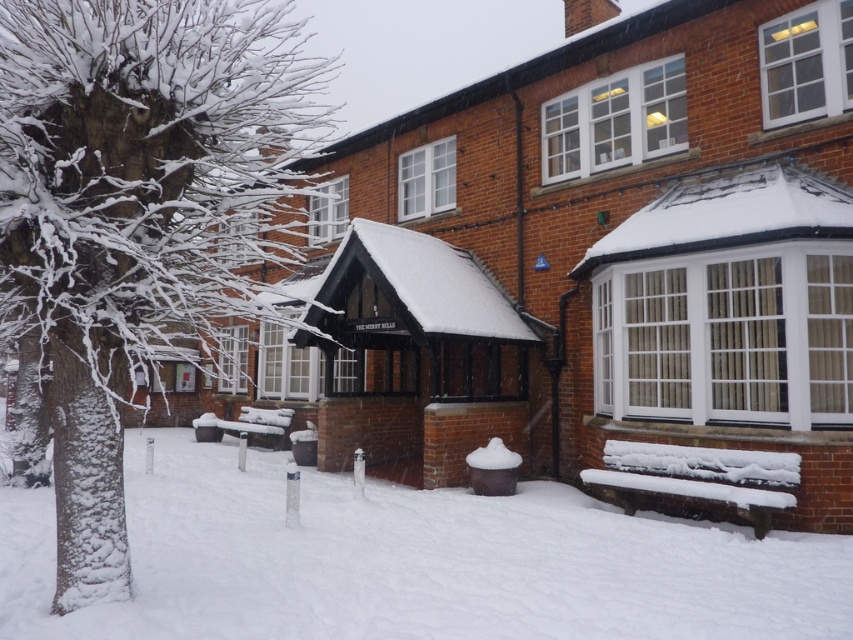
You are standing at the entrance of THE MERRY BELLS and want to sit down. The wooden bench at center is your only option. Is the white fluffy snow at lower center between you and the bench?

Yes, the white fluffy snow at lower center is between you and the wooden bench at center because it is closer to the viewer than the bench.